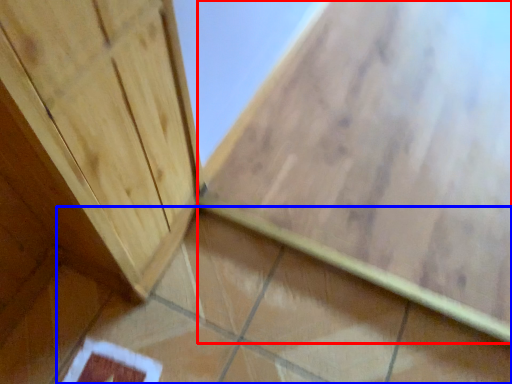
Question: Which object appears farthest to the camera in this image, ceramic tile (highlighted by a red box) or ceramic tile (highlighted by a blue box)?

Choices:
 (A) ceramic tile
 (B) ceramic tile

Answer: (A)